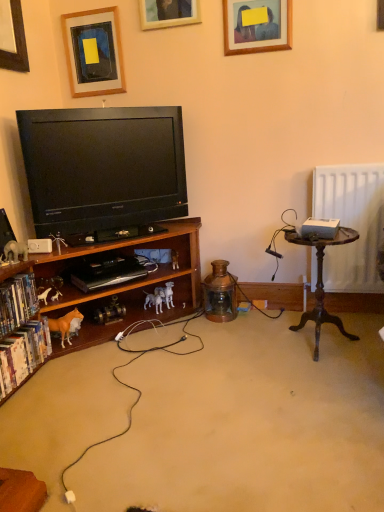
You are a GUI agent. You are given a task and a screenshot of the screen. Output one action in this format:
    pyautogui.click(x=<x>, y=<y>)
    Task: Click on the vacant space in copper glass lantern at center, which is the first toy from right to left (from a real-world perspective)
    
    Given the screenshot: What is the action you would take?
    pyautogui.click(x=221, y=320)